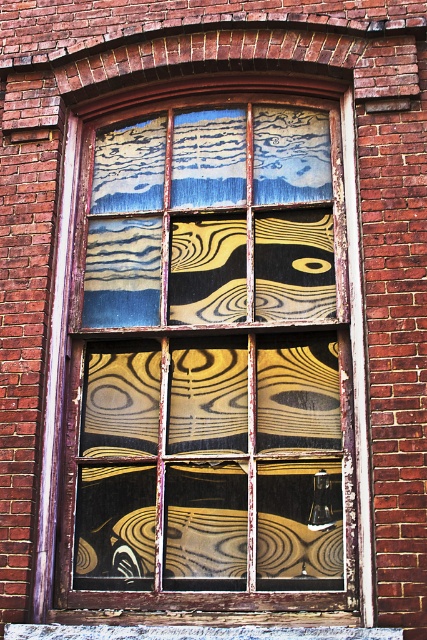
Question: Does wooden window at center come in front of wooden at lower center?

Choices:
 (A) yes
 (B) no

Answer: (B)

Question: Can you confirm if wooden window at center is positioned below wooden at lower center?

Choices:
 (A) yes
 (B) no

Answer: (B)

Question: Does wooden window at center have a larger size compared to wooden at lower center?

Choices:
 (A) yes
 (B) no

Answer: (A)

Question: Which point is closer to the camera taking this photo?

Choices:
 (A) (43, 628)
 (B) (63, 451)

Answer: (A)